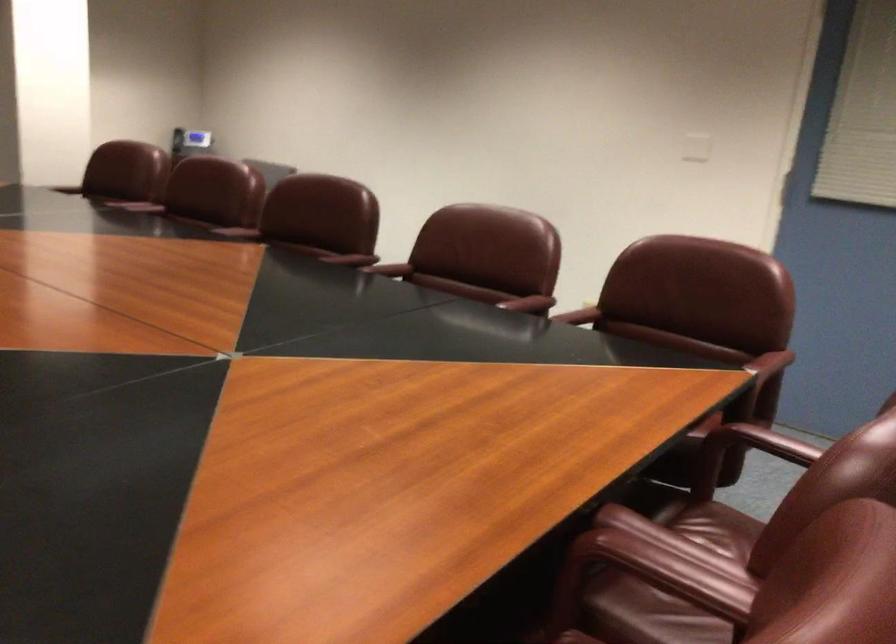
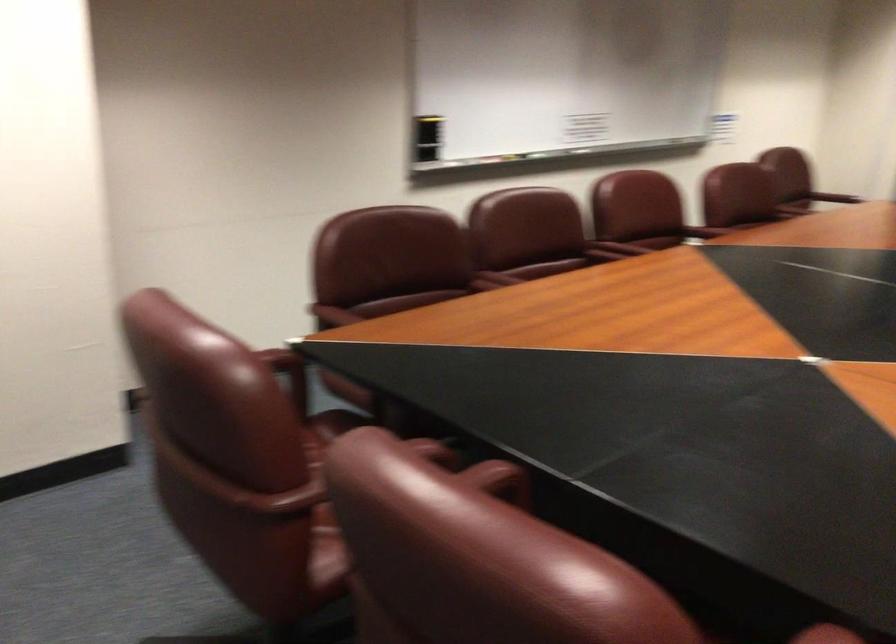
Locate, in the second image, the point that corresponds to (528,299) in the first image.

(495, 478)